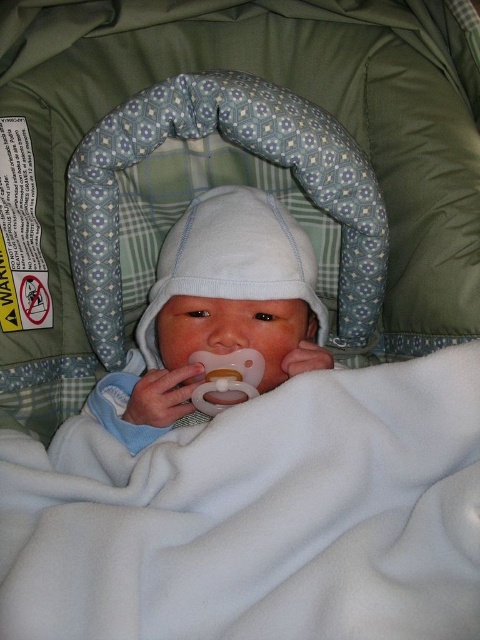
Is white fleece blanket at center wider than white soft baby at center?

Indeed, white fleece blanket at center has a greater width compared to white soft baby at center.

Can you confirm if white fleece blanket at center is taller than white soft baby at center?

No, white fleece blanket at center is not taller than white soft baby at center.

Is point (88, 572) farther from viewer compared to point (186, 296)?

No, (88, 572) is in front of (186, 296).

Locate an element on the screen. The width and height of the screenshot is (480, 640). white fleece blanket at center is located at coordinates (257, 516).